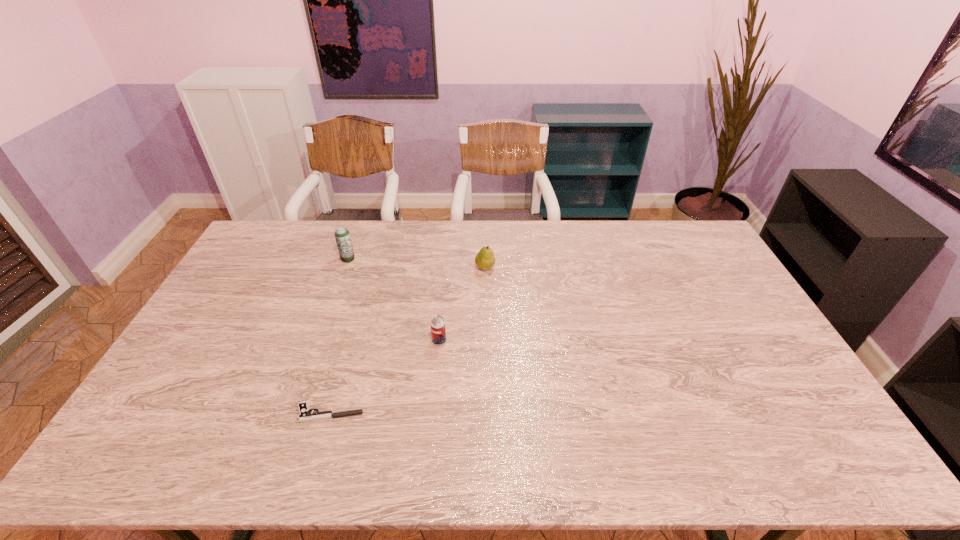
Identify which object is located as the third nearest to the rightmost object. Please provide its 2D coordinates. Your answer should be formatted as a tuple, i.e. [(x, y)], where the tuple contains the x and y coordinates of a point satisfying the conditions above.

[(305, 416)]

Choose which object is the third nearest neighbor to the left beer can. Please provide its 2D coordinates. Your answer should be formatted as a tuple, i.e. [(x, y)], where the tuple contains the x and y coordinates of a point satisfying the conditions above.

[(305, 416)]

Find the location of `vacant space that satisfies the following two spatial constraints: 1. on the front side of the taller beer can; 2. on the left side of the pear`. vacant space that satisfies the following two spatial constraints: 1. on the front side of the taller beer can; 2. on the left side of the pear is located at coordinates (345, 267).